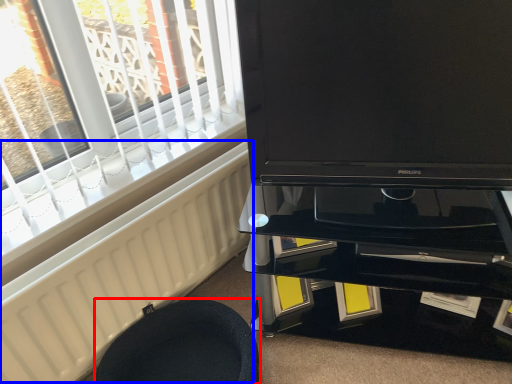
Question: Among these objects, which one is nearest to the camera, furniture (highlighted by a red box) or radiator (highlighted by a blue box)?

Choices:
 (A) furniture
 (B) radiator

Answer: (B)